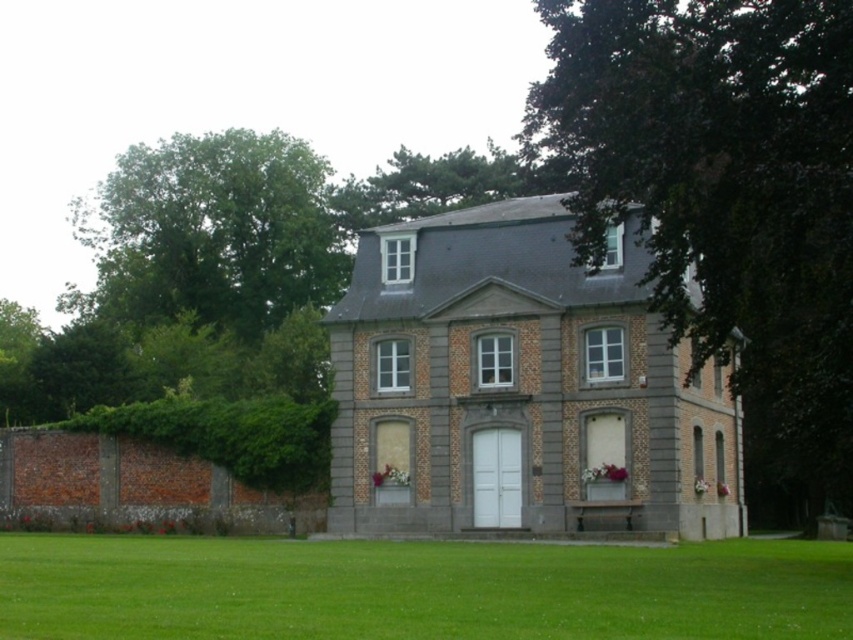
Who is taller, green grass at lower center or green leafy tree at upper left?

Standing taller between the two is green leafy tree at upper left.

Is point (666, 625) farther from viewer compared to point (326, 241)?

No, it is in front of (326, 241).

Who is more distant from viewer, (271, 592) or (107, 269)?

The point (107, 269) is more distant.

Image resolution: width=853 pixels, height=640 pixels. Find the location of `green grass at lower center`. green grass at lower center is located at coordinates (418, 589).

In the scene shown: Who is higher up, green leafy tree at upper left or green leafy hedge at left?

green leafy tree at upper left is higher up.

Does point (241, 170) lie in front of point (289, 452)?

No, it is behind (289, 452).

Identify the location of green leafy tree at upper left. The image size is (853, 640). (212, 232).

Is dark green leafy tree at right taller than green leafy tree at upper left?

Yes.

Who is more forward, (589, 120) or (212, 257)?

Point (589, 120)

This screenshot has height=640, width=853. I want to click on dark green leafy tree at right, so [x=724, y=198].